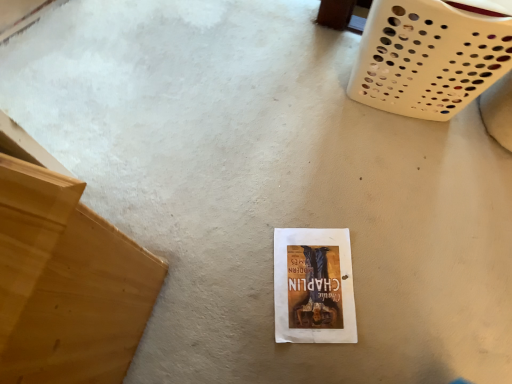
Identify the location of vacant area that lies between white paper at center and white plastic basket at upper right. (358, 183).